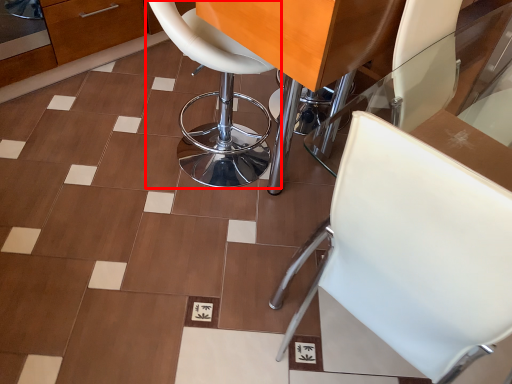
Question: In this image, where is chair (annotated by the red box) located relative to chair?

Choices:
 (A) left
 (B) right

Answer: (A)